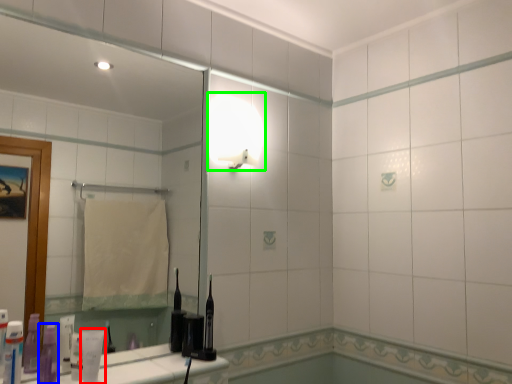
Question: Considering the real-world distances, which object is closest to toiletry (highlighted by a red box)? toiletry (highlighted by a blue box) or light fixture (highlighted by a green box).

Choices:
 (A) toiletry
 (B) light fixture

Answer: (A)